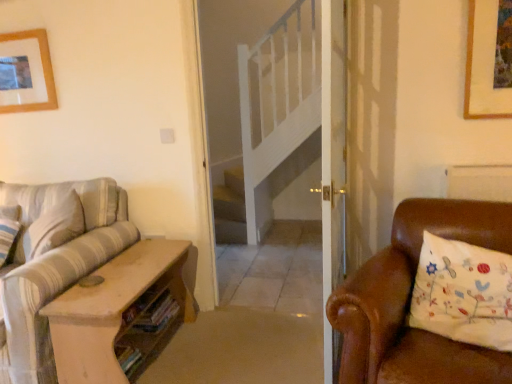
Question: Is striped fabric couch at left wider or thinner than white embroidered pillow at right?

Choices:
 (A) wide
 (B) thin

Answer: (A)

Question: In terms of size, does striped fabric couch at left appear bigger or smaller than white embroidered pillow at right?

Choices:
 (A) big
 (B) small

Answer: (A)

Question: Which object is positioned closest to the white embroidered pillow at right?

Choices:
 (A) striped fabric couch at left
 (B) wooden picture frame at upper left

Answer: (A)

Question: Estimate the real-world distances between objects in this image. Which object is farther from the striped fabric couch at left?

Choices:
 (A) white embroidered pillow at right
 (B) wooden picture frame at upper left

Answer: (A)